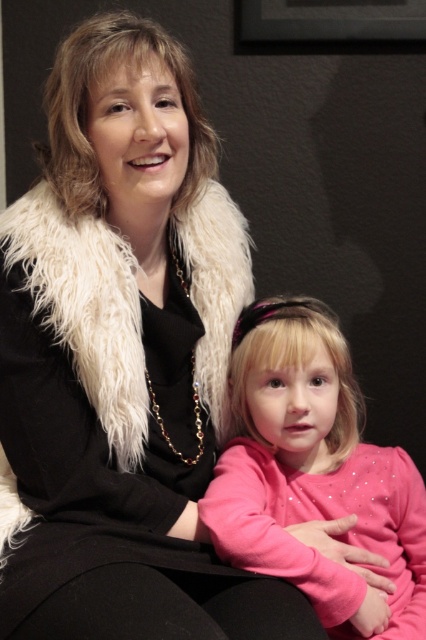
Between point (354, 412) and point (71, 307), which one is positioned behind?

Point (354, 412)

Can you confirm if pink glittery sweater at center is positioned above white fluffy fur coat at upper left?

No, pink glittery sweater at center is not above white fluffy fur coat at upper left.

This screenshot has width=426, height=640. What are the coordinates of `pink glittery sweater at center` in the screenshot? It's located at (314, 474).

The height and width of the screenshot is (640, 426). I want to click on pink glittery sweater at center, so click(x=314, y=474).